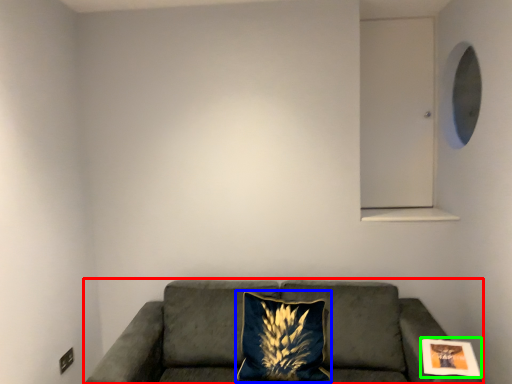
Question: Estimate the real-world distances between objects in this image. Which object is farther from studio couch (highlighted by a red box), pillow (highlighted by a blue box) or picture frame (highlighted by a green box)?

Choices:
 (A) pillow
 (B) picture frame

Answer: (B)